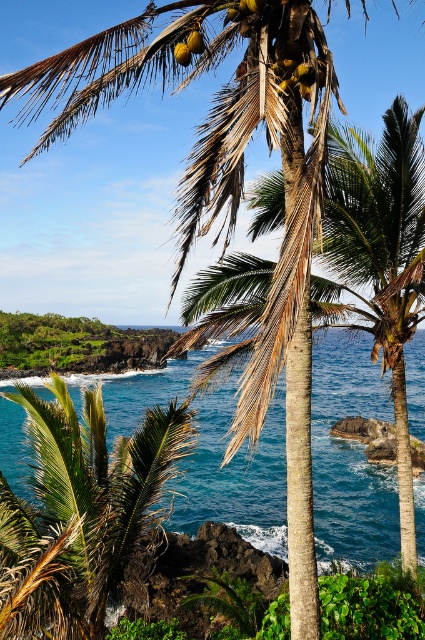
You are standing on the beach and see the blue water at center and the yellow matte coconut at center. Which one is located to the right side from your perspective?

The blue water at center is located to the right of the yellow matte coconut at center.

You are standing on the beach looking at the blue water at center and the yellow matte coconut at upper center. Which object is closer to you?

The blue water at center is closer to you because it is further to the viewer than the yellow matte coconut at upper center.

You are a photographer trying to capture the blue water at center and the yellow matte coconut at center in a single frame. Which object will appear bigger in your photo?

The blue water at center will appear bigger in the photo because it has a larger size compared to the yellow matte coconut at center.